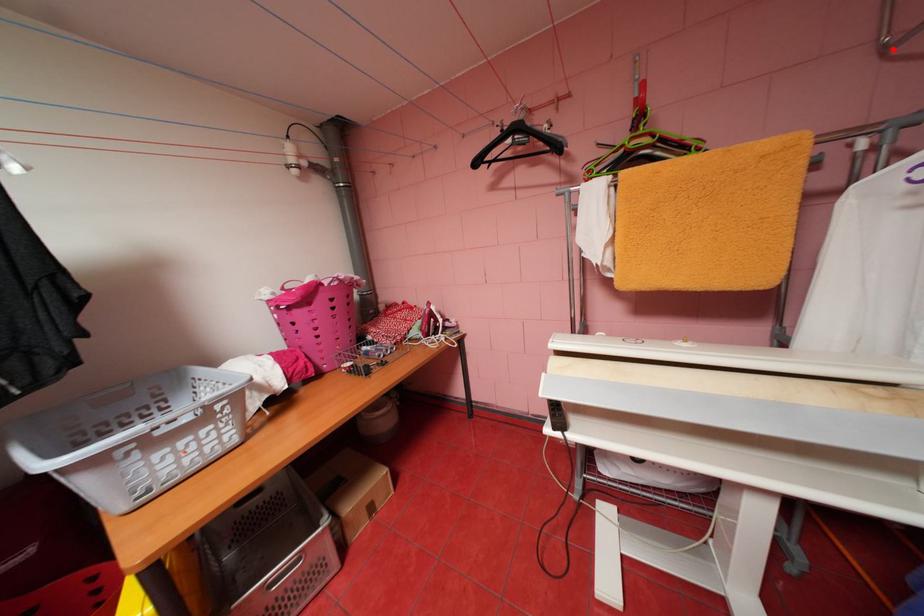
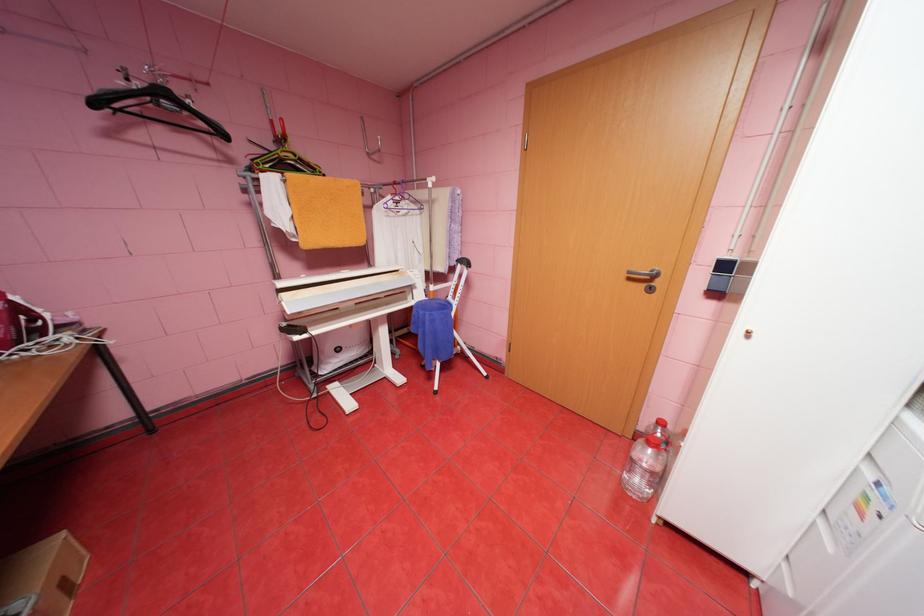
Find the pixel in the second image that matches the highlighted location in the first image.

(377, 154)